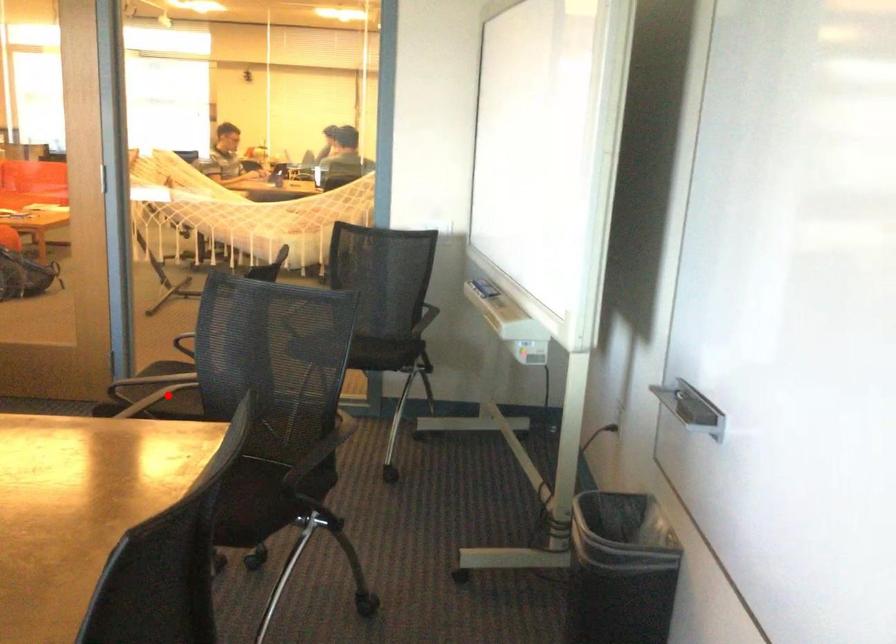
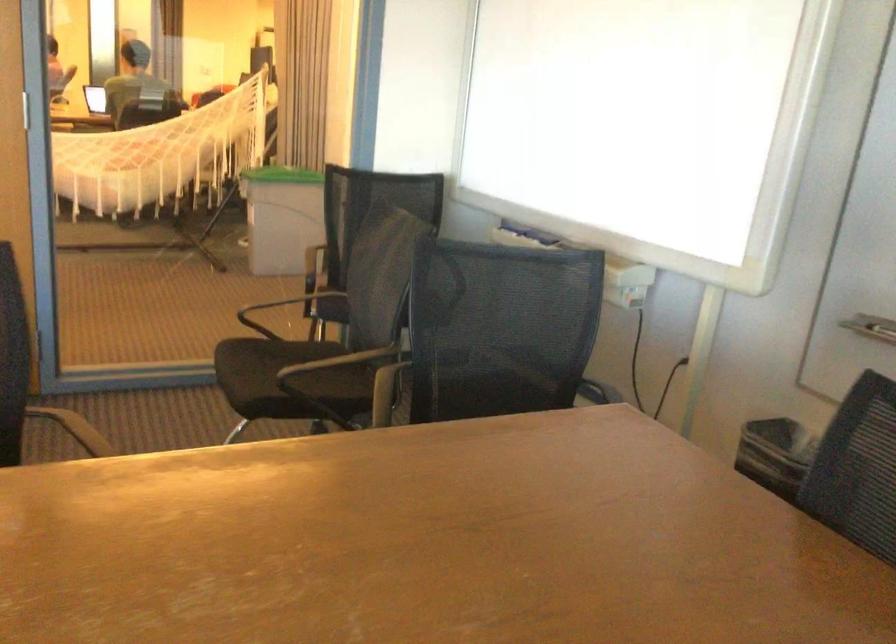
The point at the highlighted location is marked in the first image. Where is the corresponding point in the second image?

(288, 379)